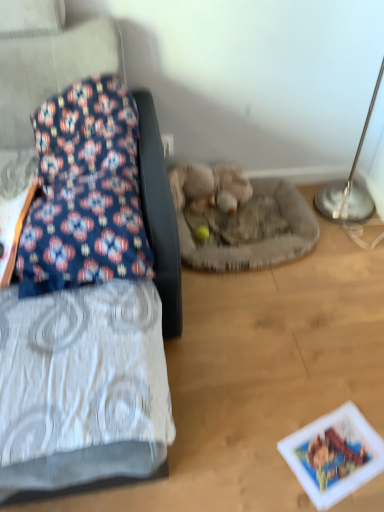
What are the coordinates of `free space behind printed paper postcard at lower right` in the screenshot? It's located at (321, 387).